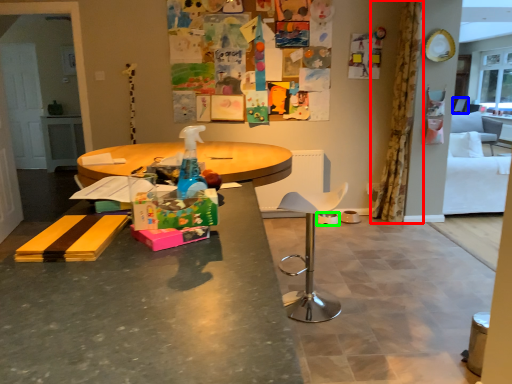
Question: Based on their relative distances, which object is farther from curtain (highlighted by a red box)? Choose from armchair (highlighted by a blue box) and bowl (highlighted by a green box).

Choices:
 (A) armchair
 (B) bowl

Answer: (A)